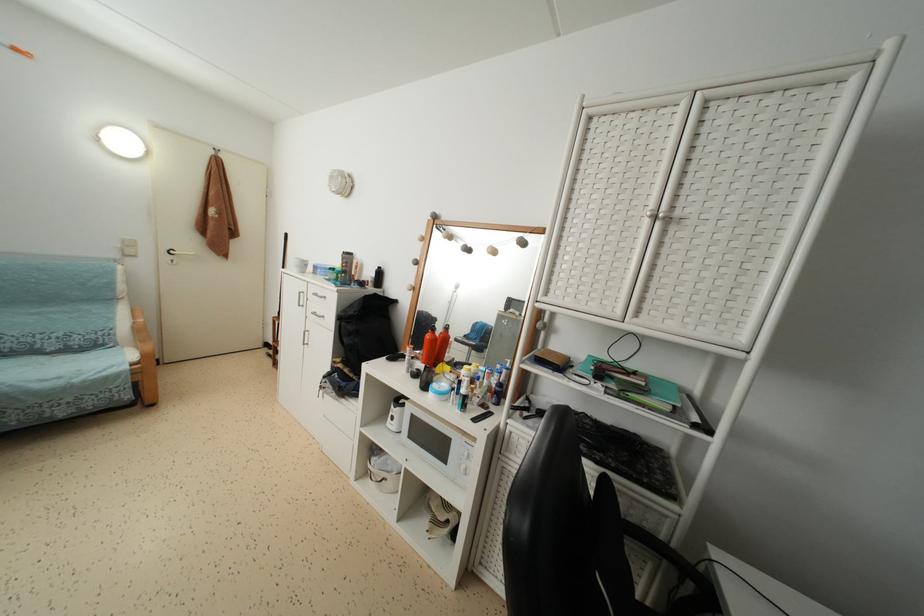
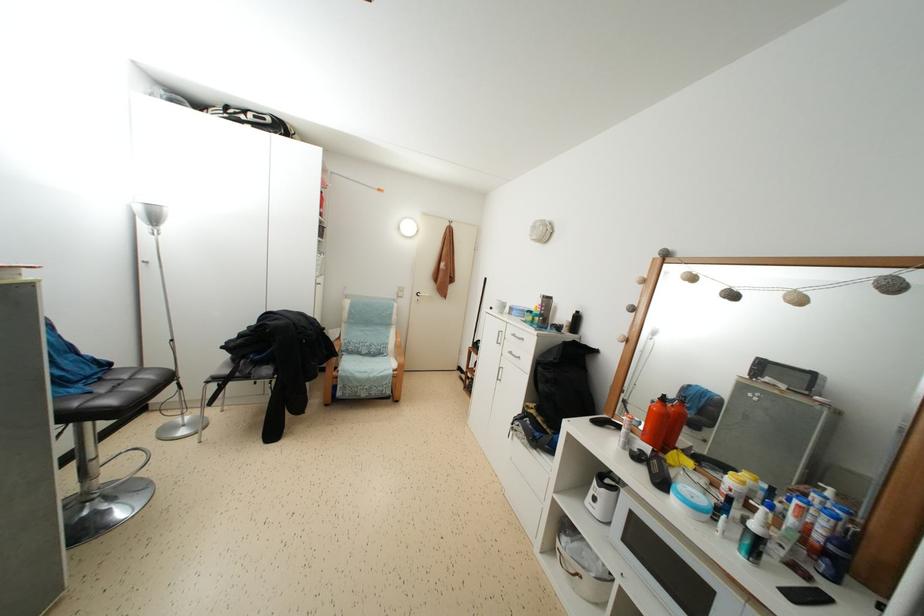
Where in the second image is the point corresponding to (x=468, y=403) from the first image?

(763, 546)